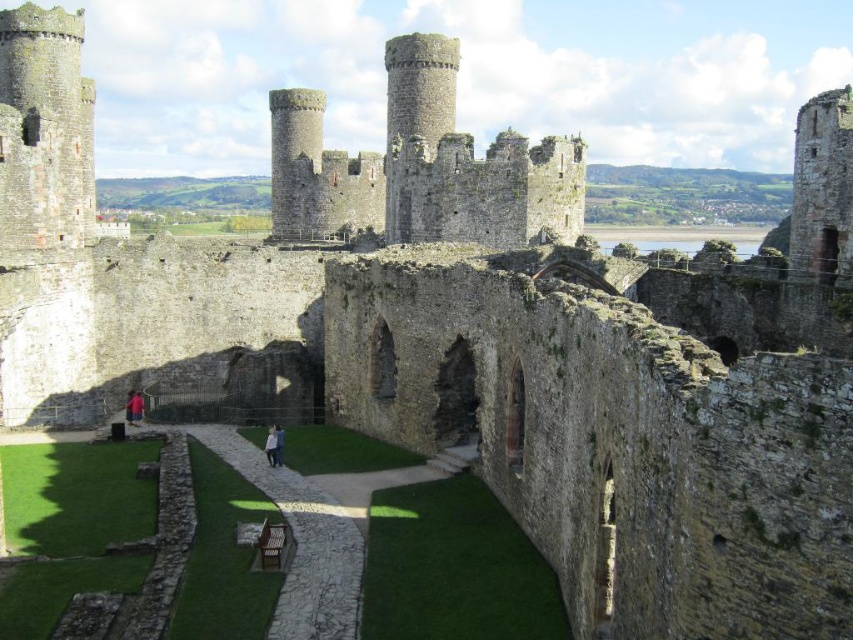
Is rustic stone castle at center below pink fabric at center?

No, rustic stone castle at center is not below pink fabric at center.

Does rustic stone castle at center appear on the right side of pink fabric at center?

Indeed, rustic stone castle at center is positioned on the right side of pink fabric at center.

Which is behind, point (351, 164) or point (270, 456)?

The point (351, 164) is behind.

Where is `rustic stone castle at center`? The image size is (853, 640). rustic stone castle at center is located at coordinates (421, 164).

Which of these two, pink fabric at center or light brown leather jacket at center, stands taller?

Standing taller between the two is pink fabric at center.

Is pink fabric at center thinner than light brown leather jacket at center?

In fact, pink fabric at center might be wider than light brown leather jacket at center.

This screenshot has width=853, height=640. Find the location of `pink fabric at center`. pink fabric at center is located at coordinates (271, 445).

Where is `pink fabric at center`? This screenshot has height=640, width=853. pink fabric at center is located at coordinates pyautogui.click(x=271, y=445).

Who is higher up, rustic stone castle at center or light brown leather jacket at center?

rustic stone castle at center is higher up.

Who is more distant from viewer, (451, 170) or (277, 449)?

Positioned behind is point (451, 170).

Where is `rustic stone castle at center`? The height and width of the screenshot is (640, 853). rustic stone castle at center is located at coordinates (421, 164).